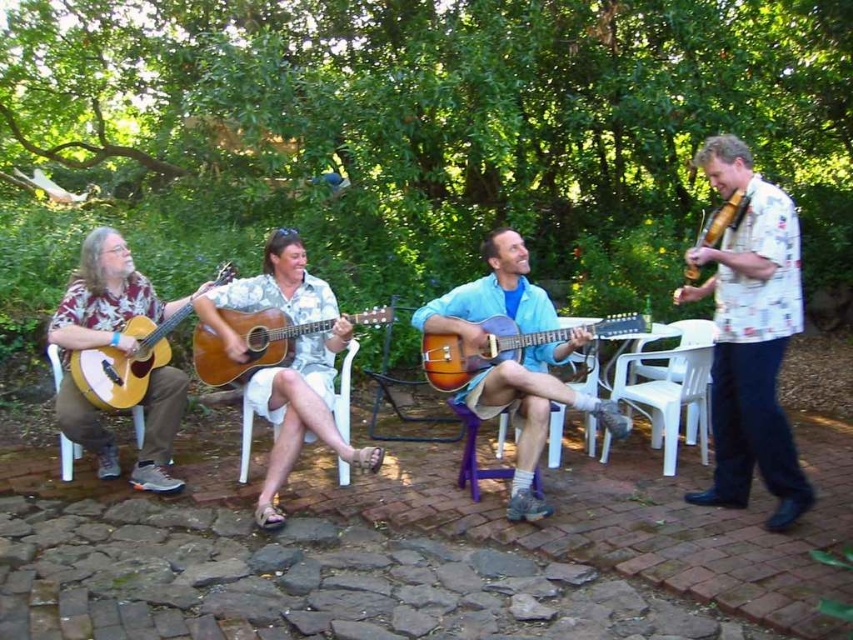
Question: Which of the following is the closest to the observer?

Choices:
 (A) (123, 365)
 (B) (711, 232)
 (C) (751, 476)

Answer: (B)

Question: Is white plastic chair at right smaller than sunburst wood guitar at center?

Choices:
 (A) no
 (B) yes

Answer: (A)

Question: Can you confirm if matte wood guitar at left is positioned above wooden acoustic guitar at right?

Choices:
 (A) yes
 (B) no

Answer: (B)

Question: Estimate the real-world distances between objects in this image. Which object is farther from the wooden acoustic guitar at center?

Choices:
 (A) white plastic chair at right
 (B) brown wooden guitar at center

Answer: (A)

Question: Among these points, which one is nearest to the camera?

Choices:
 (A) (61, 449)
 (B) (656, 426)
 (C) (259, 353)
 (D) (537, 332)

Answer: (D)

Question: Is wooden acoustic guitar at center thinner than white plastic chair at center?

Choices:
 (A) no
 (B) yes

Answer: (A)